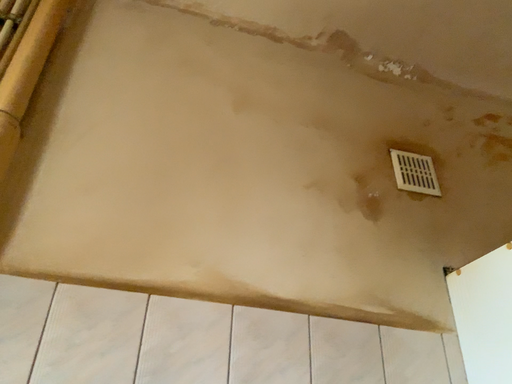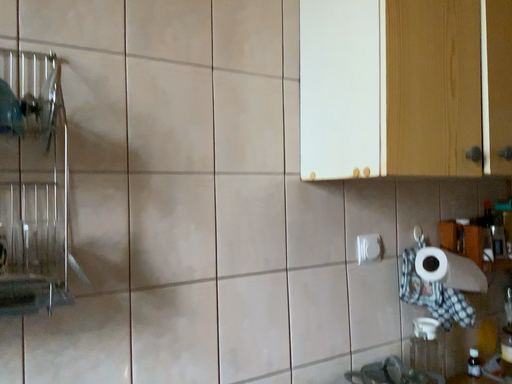
Question: Which way did the camera rotate in the video?

Choices:
 (A) rotated right
 (B) rotated left

Answer: (A)